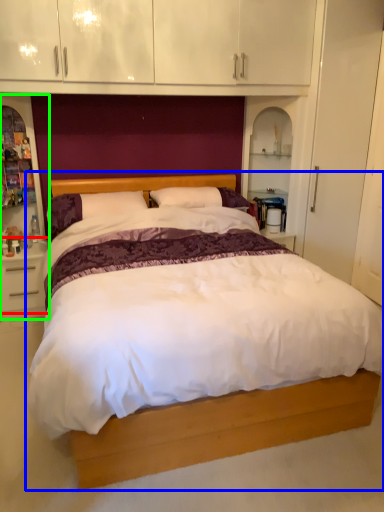
Question: Considering the real-world distances, which object is farthest from nightstand (highlighted by a red box)? bed (highlighted by a blue box) or dresser (highlighted by a green box)?

Choices:
 (A) bed
 (B) dresser

Answer: (A)